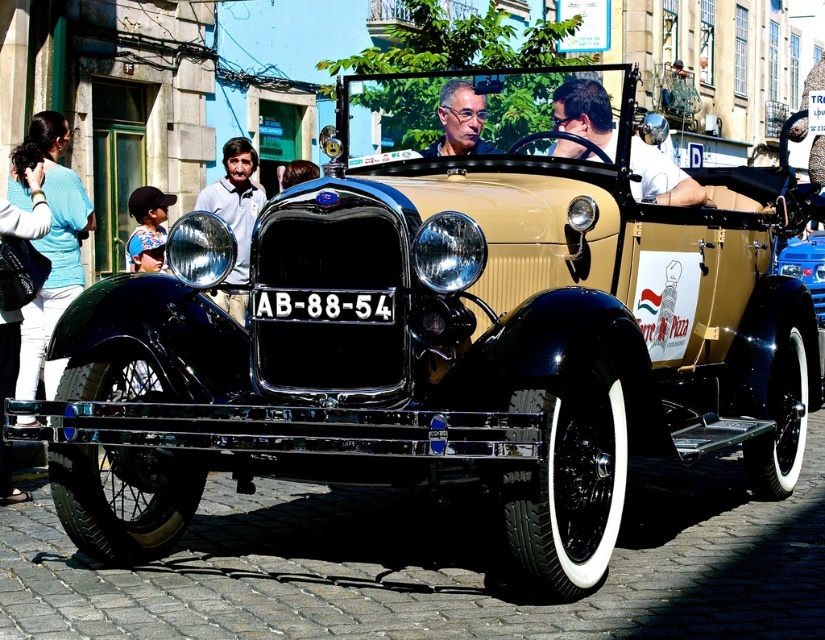
You are standing in front of the vintage car and want to touch both points on the car. Which point should you reach for first, point (x=217, y=209) or point (x=451, y=129)?

You should reach for point (x=217, y=209) first because it is closer to you than point (x=451, y=129), which is further away.